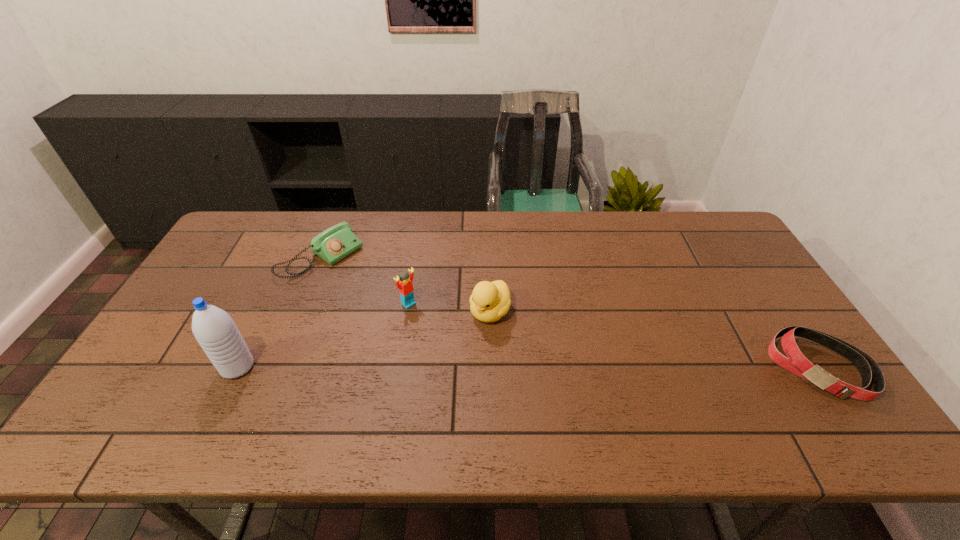
Where is `vacant space positioned on the front-facing side of the duck`? vacant space positioned on the front-facing side of the duck is located at coordinates (465, 350).

The height and width of the screenshot is (540, 960). Find the location of `vacant area situated 0.100m on the front-facing side of the duck`. vacant area situated 0.100m on the front-facing side of the duck is located at coordinates (463, 353).

Locate an element on the screen. vacant space located 0.170m on the front-facing side of the duck is located at coordinates (448, 373).

The image size is (960, 540). Find the location of `vacant region located 0.320m on the dial of the telephone`. vacant region located 0.320m on the dial of the telephone is located at coordinates tap(418, 325).

Where is `vacant space located on the dial of the telephone`? vacant space located on the dial of the telephone is located at coordinates (358, 283).

This screenshot has width=960, height=540. I want to click on free space located on the dial of the telephone, so click(377, 296).

Identify the location of object located in the far edge section of the desktop. This screenshot has width=960, height=540. (337, 242).

At what (x,y) coordinates should I click in order to perform the action: click on water bottle at the near edge. Please return your answer as a coordinate pair (x, y). The width and height of the screenshot is (960, 540). Looking at the image, I should click on (214, 329).

Locate an element on the screen. This screenshot has width=960, height=540. dog collar present at the near edge is located at coordinates (795, 362).

Locate an element on the screen. This screenshot has width=960, height=540. object present at the right edge is located at coordinates (795, 362).